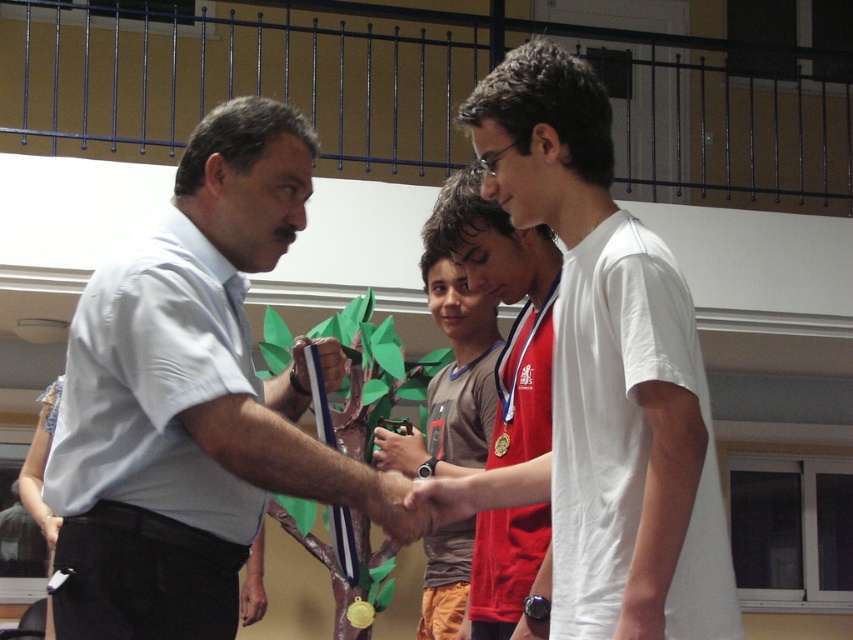
Who is shorter, matte red shirt at center or brown fabric shirt at center?

With less height is brown fabric shirt at center.

Is matte red shirt at center positioned behind brown fabric shirt at center?

No, matte red shirt at center is closer to the viewer.

Locate an element on the screen. matte red shirt at center is located at coordinates (505, 301).

Is light blue shirt at center bigger than brown fabric shirt at center?

Indeed, light blue shirt at center has a larger size compared to brown fabric shirt at center.

This screenshot has width=853, height=640. I want to click on light blue shirt at center, so click(x=190, y=400).

You are a GUI agent. You are given a task and a screenshot of the screen. Output one action in this format:
    pyautogui.click(x=<x>, y=<y>)
    Task: Click on the light blue shirt at center
    
    Given the screenshot: What is the action you would take?
    pyautogui.click(x=190, y=400)

Between white cotton t-shirt at center and matte red shirt at center, which one has more height?

white cotton t-shirt at center

Who is more forward, (605, 285) or (508, 269)?

Point (605, 285) is in front.

At what (x,y) coordinates should I click in order to perform the action: click on white cotton t-shirt at center. Please return your answer as a coordinate pair (x, y). The width and height of the screenshot is (853, 640). Looking at the image, I should click on (602, 378).